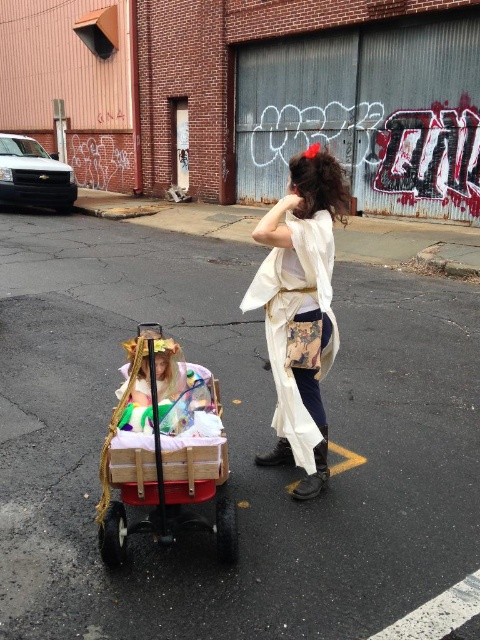
Who is lower down, wooden baby carriage at center or white silk kimono at center?

wooden baby carriage at center is lower down.

Does wooden baby carriage at center appear under white silk kimono at center?

Yes.

The width and height of the screenshot is (480, 640). What are the coordinates of `wooden baby carriage at center` in the screenshot? It's located at (164, 451).

Locate an element on the screen. wooden baby carriage at center is located at coordinates (164, 451).